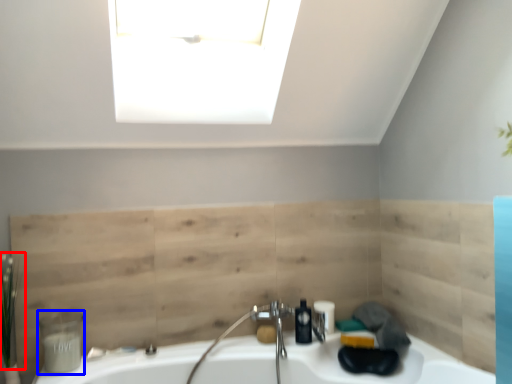
Question: Which object is closer to the camera taking this photo, plant (highlighted by a red box) or toiletry (highlighted by a blue box)?

Choices:
 (A) plant
 (B) toiletry

Answer: (A)